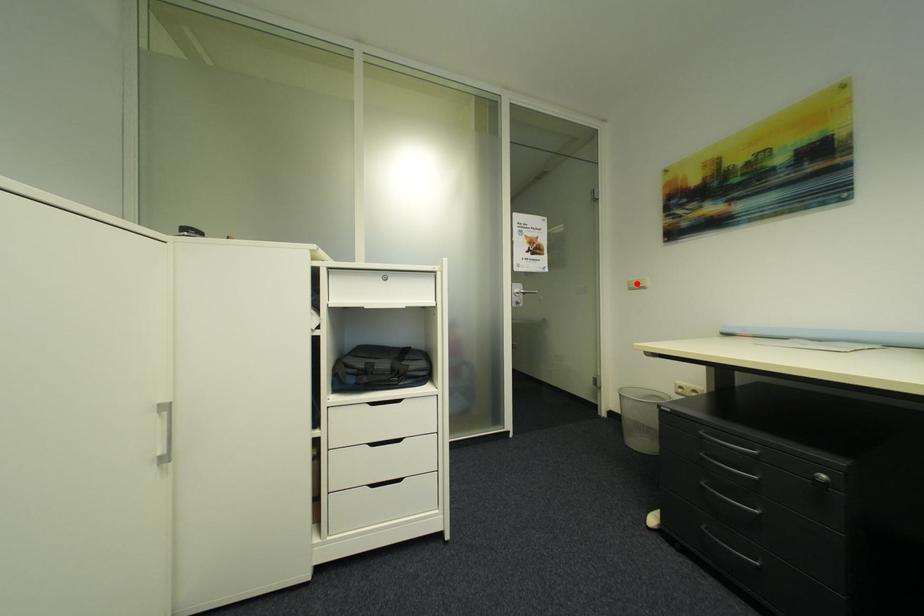
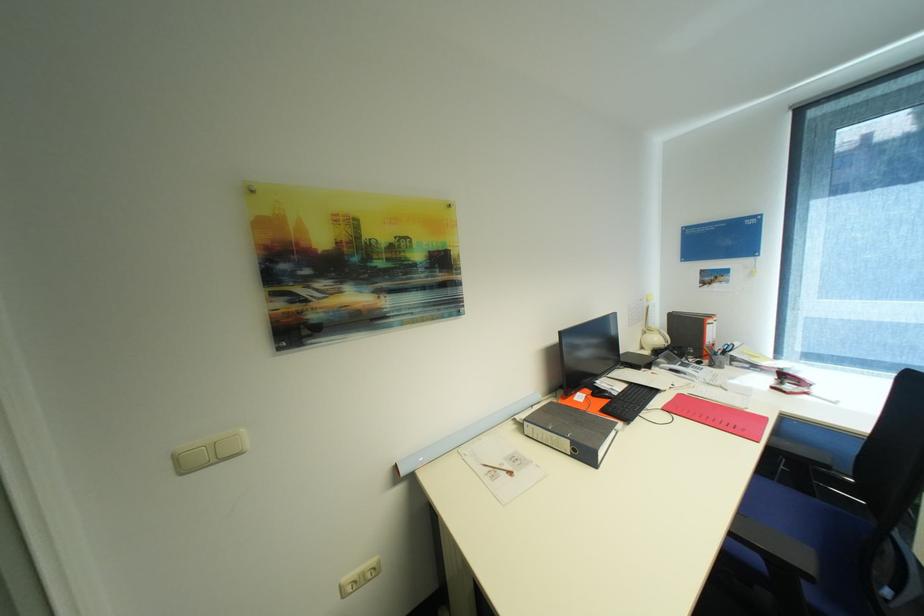
The point at the highlighted location is marked in the first image. Where is the corresponding point in the second image?

(185, 458)